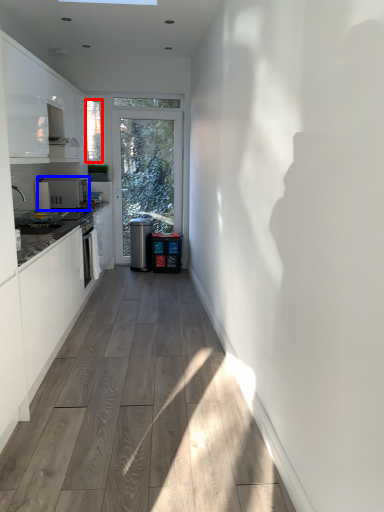
Question: Which point is closer to the camera, window screen (highlighted by a red box) or appliance (highlighted by a blue box)?

Choices:
 (A) window screen
 (B) appliance

Answer: (B)